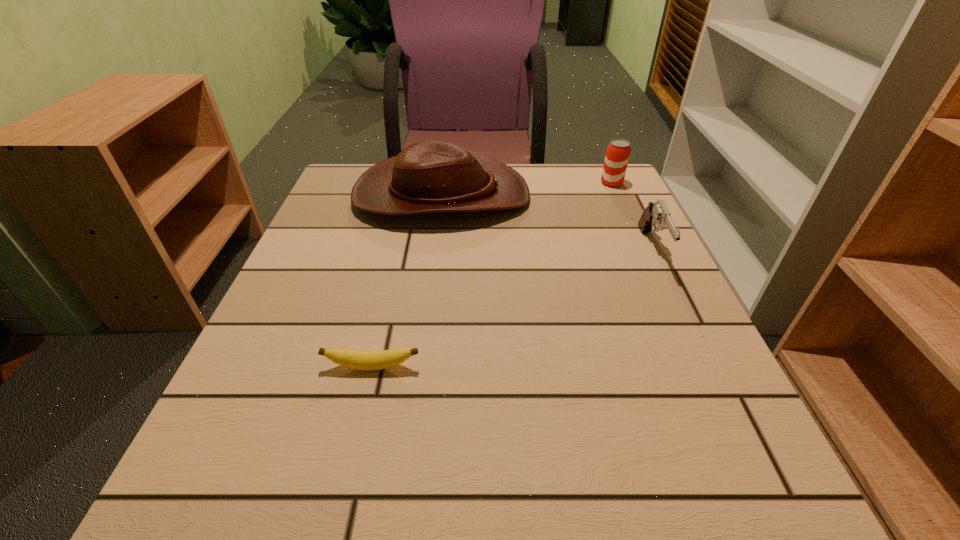
The height and width of the screenshot is (540, 960). I want to click on beer can situated at the far edge, so click(618, 151).

I want to click on cowboy hat situated at the left edge, so click(428, 176).

The height and width of the screenshot is (540, 960). I want to click on banana at the left edge, so click(x=358, y=359).

This screenshot has height=540, width=960. Find the location of `beer can that is at the right edge`. beer can that is at the right edge is located at coordinates (618, 151).

Find the location of a particular element. gun located at the right edge is located at coordinates (656, 213).

Find the location of a particular element. The width and height of the screenshot is (960, 540). object that is positioned at the far left corner is located at coordinates (428, 176).

You are a GUI agent. You are given a task and a screenshot of the screen. Output one action in this format:
    pyautogui.click(x=<x>, y=<y>)
    Task: Click on the object that is at the far right corner
    The image size is (960, 540).
    Given the screenshot: What is the action you would take?
    pyautogui.click(x=618, y=151)

At what (x,y) coordinates should I click in order to perform the action: click on free space at the near edge of the desktop. Please return your answer as a coordinate pair (x, y). Image resolution: width=960 pixels, height=540 pixels. Looking at the image, I should click on (643, 525).

Locate an element on the screen. This screenshot has height=540, width=960. vacant space at the left edge is located at coordinates (351, 345).

The height and width of the screenshot is (540, 960). Identify the location of vacant region at the right edge. (604, 317).